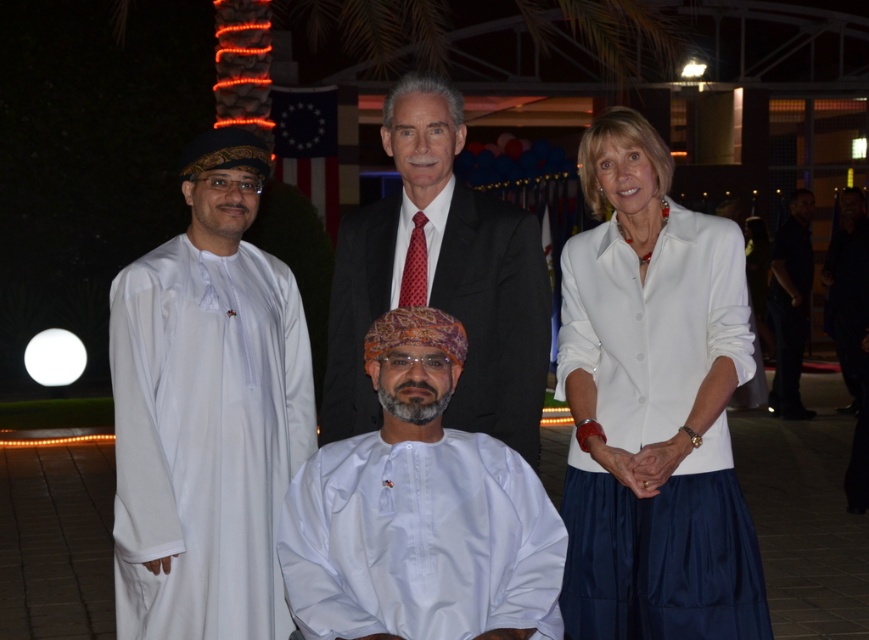
Question: Which point appears farthest from the camera in this image?

Choices:
 (A) (721, 326)
 (B) (777, 339)
 (C) (125, 465)
 (D) (363, 304)

Answer: (B)

Question: Does white satin blouse at center have a greater width compared to white satin blouse at upper right?

Choices:
 (A) no
 (B) yes

Answer: (A)

Question: Which point is farther to the camera?

Choices:
 (A) matte black suit at center
 (B) white satin blouse at upper right

Answer: (A)

Question: Among these objects, which one is nearest to the camera?

Choices:
 (A) white satin blouse at center
 (B) white cotton robe at left
 (C) black smooth shirt at right

Answer: (B)

Question: Does matte black suit at center appear under white satin blouse at upper right?

Choices:
 (A) yes
 (B) no

Answer: (B)

Question: Can you confirm if white cotton robe at left is wider than white satin blouse at upper right?

Choices:
 (A) yes
 (B) no

Answer: (B)